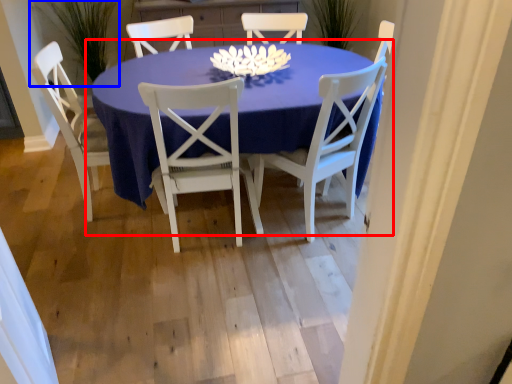
Question: Which object appears closest to the camera in this image, kitchen & dining room table (highlighted by a red box) or plant (highlighted by a blue box)?

Choices:
 (A) kitchen & dining room table
 (B) plant

Answer: (A)